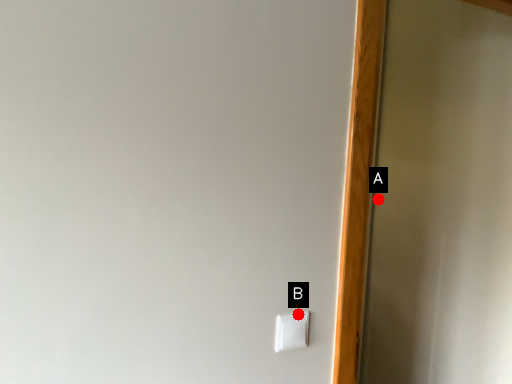
Question: Two points are circled on the image, labeled by A and B beside each circle. Which of the following is the closest to the observer?

Choices:
 (A) A is closer
 (B) B is closer

Answer: (B)